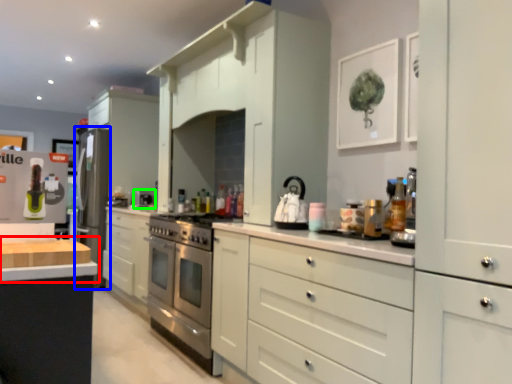
Question: Which is nearer to the countertop (highlighted by a red box)? appliance (highlighted by a blue box) or appliance (highlighted by a green box).

Choices:
 (A) appliance
 (B) appliance

Answer: (B)